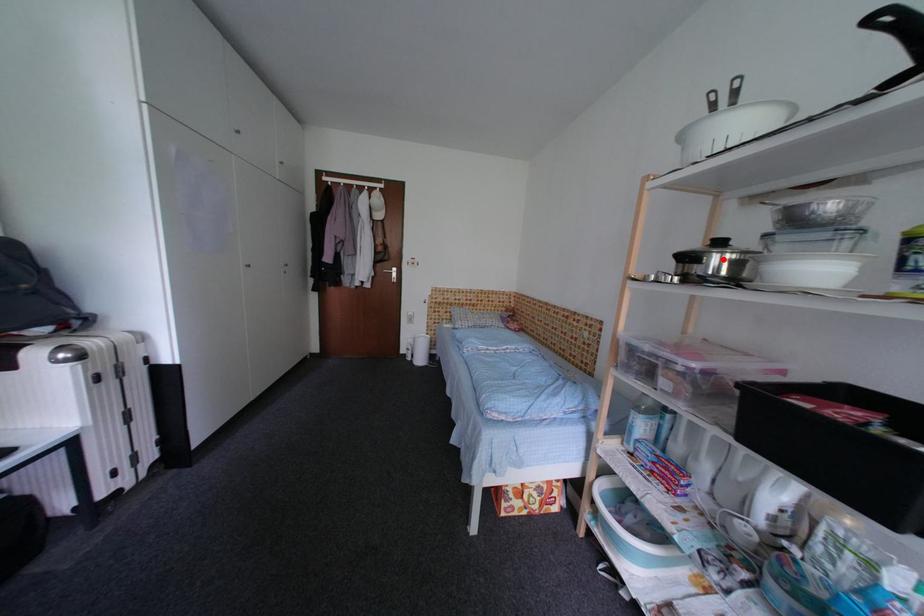
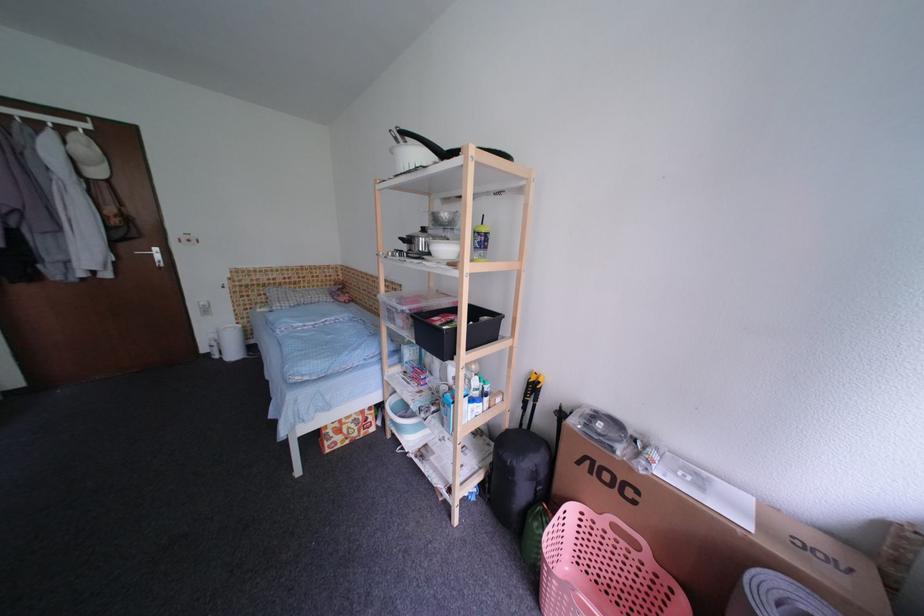
Locate, in the second image, the point that corresponds to the highlighted location in the first image.

(430, 241)